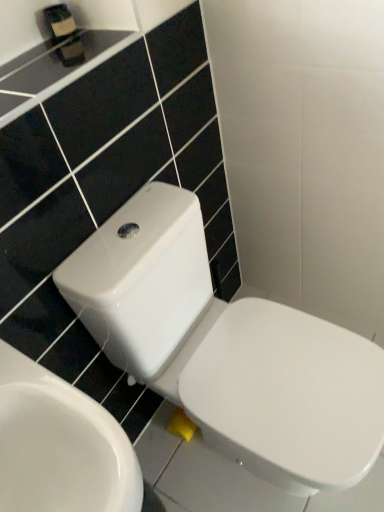
Question: Is white glossy toilet at center, the 2th toilet viewed from the left, wider than white glossy toilet at lower right, placed as the 1th toilet when sorted from left to right?

Choices:
 (A) no
 (B) yes

Answer: (B)

Question: Does white glossy toilet at center, placed as the first toilet when sorted from right to left, appear on the left side of white glossy toilet at lower right, positioned as the second toilet in right-to-left order?

Choices:
 (A) yes
 (B) no

Answer: (B)

Question: Considering the relative sizes of white glossy toilet at center, the 2th toilet viewed from the left, and white glossy toilet at lower right, placed as the 1th toilet when sorted from left to right, in the image provided, is white glossy toilet at center, the 2th toilet viewed from the left, shorter than white glossy toilet at lower right, placed as the 1th toilet when sorted from left to right,?

Choices:
 (A) no
 (B) yes

Answer: (A)

Question: Are white glossy toilet at center, placed as the first toilet when sorted from right to left, and white glossy toilet at lower right, placed as the 1th toilet when sorted from left to right, making contact?

Choices:
 (A) yes
 (B) no

Answer: (B)

Question: Would you say white glossy toilet at lower right, positioned as the second toilet in right-to-left order, is part of white glossy toilet at center, placed as the first toilet when sorted from right to left,'s contents?

Choices:
 (A) no
 (B) yes

Answer: (A)

Question: Is white glossy toilet at center, the 2th toilet viewed from the left, smaller than white glossy toilet at lower right, positioned as the second toilet in right-to-left order?

Choices:
 (A) no
 (B) yes

Answer: (A)

Question: Can you confirm if white glossy toilet at lower right, placed as the 1th toilet when sorted from left to right, is positioned to the left of white glossy toilet at center, the 2th toilet viewed from the left?

Choices:
 (A) yes
 (B) no

Answer: (A)

Question: Does white glossy toilet at lower right, positioned as the second toilet in right-to-left order, have a smaller size compared to white glossy toilet at center, the 2th toilet viewed from the left?

Choices:
 (A) no
 (B) yes

Answer: (B)

Question: Is white glossy toilet at lower right, positioned as the second toilet in right-to-left order, positioned beyond the bounds of white glossy toilet at center, the 2th toilet viewed from the left?

Choices:
 (A) no
 (B) yes

Answer: (B)

Question: Can you confirm if white glossy toilet at lower right, positioned as the second toilet in right-to-left order, is bigger than white glossy toilet at center, the 2th toilet viewed from the left?

Choices:
 (A) yes
 (B) no

Answer: (B)

Question: Does white glossy toilet at lower right, placed as the 1th toilet when sorted from left to right, turn towards white glossy toilet at center, the 2th toilet viewed from the left?

Choices:
 (A) no
 (B) yes

Answer: (A)

Question: Is white glossy toilet at lower right, positioned as the second toilet in right-to-left order, shorter than white glossy toilet at center, the 2th toilet viewed from the left?

Choices:
 (A) yes
 (B) no

Answer: (A)

Question: Is white glossy toilet at lower right, positioned as the second toilet in right-to-left order, at the left side of matte black soap dispenser at upper left?

Choices:
 (A) yes
 (B) no

Answer: (B)